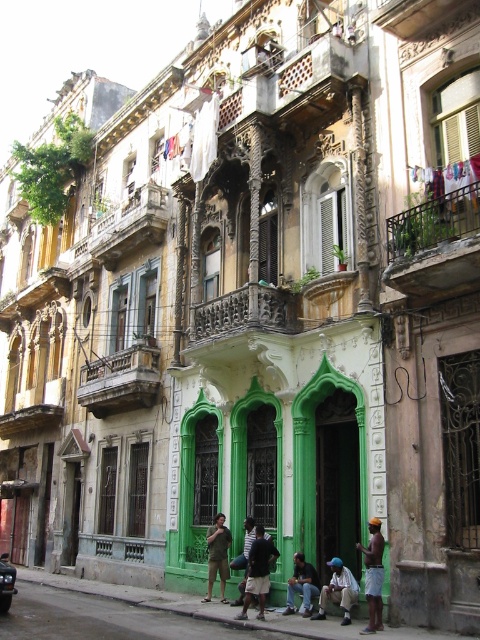
Question: Which point is closer to the camera?

Choices:
 (A) dark blue jeans at center
 (B) metallic silver car at lower left
 (C) carved wood balcony at center
 (D) dark brown leather shoes at lower center

Answer: (A)

Question: Based on their relative distances, which object is nearer to the rustic wood balcony at upper center?

Choices:
 (A) carved wood balcony at center
 (B) metallic silver car at lower left
 (C) green fabric pants at center
 (D) white cotton shirt at lower center

Answer: (A)

Question: Which is farther from the rustic wood balcony at center-left?

Choices:
 (A) metallic silver car at lower left
 (B) dark blue jeans at center

Answer: (B)

Question: Does rusty metal balcony at upper right have a smaller size compared to white cotton shirt at lower center?

Choices:
 (A) no
 (B) yes

Answer: (A)

Question: Is the position of rustic wood balcony at center-left less distant than that of white cotton shirt at lower center?

Choices:
 (A) no
 (B) yes

Answer: (A)

Question: Does rustic wood balcony at center-left appear over dark blue jeans at center?

Choices:
 (A) yes
 (B) no

Answer: (A)